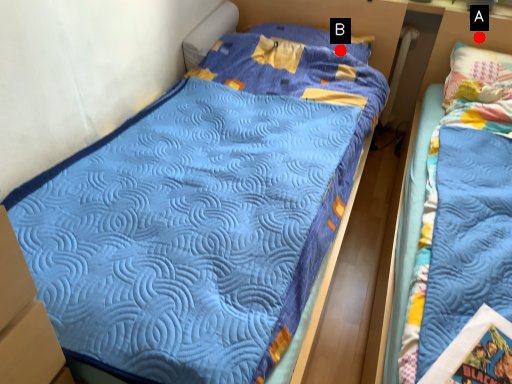
Question: Two points are circled on the image, labeled by A and B beside each circle. Among these points, which one is nearest to the camera?

Choices:
 (A) A is closer
 (B) B is closer

Answer: (A)